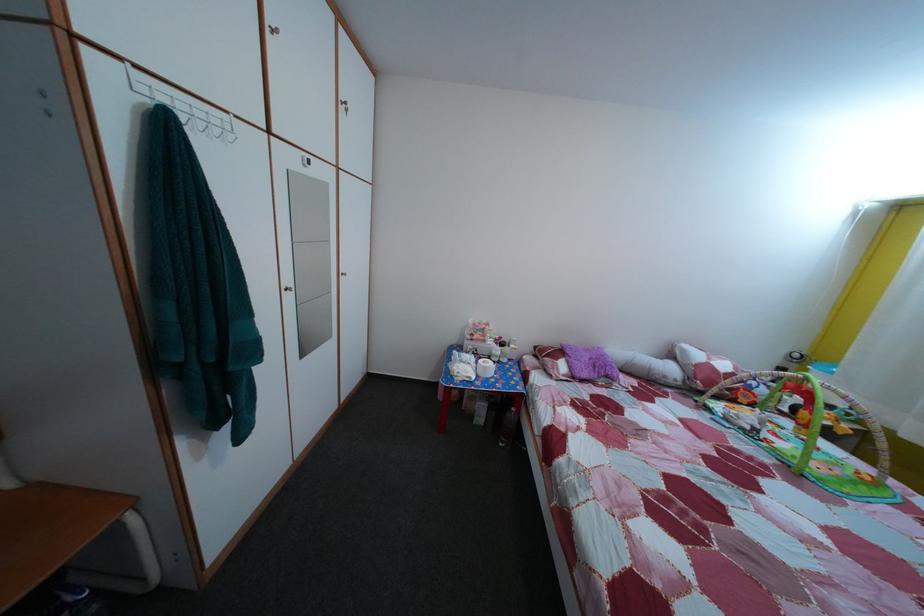
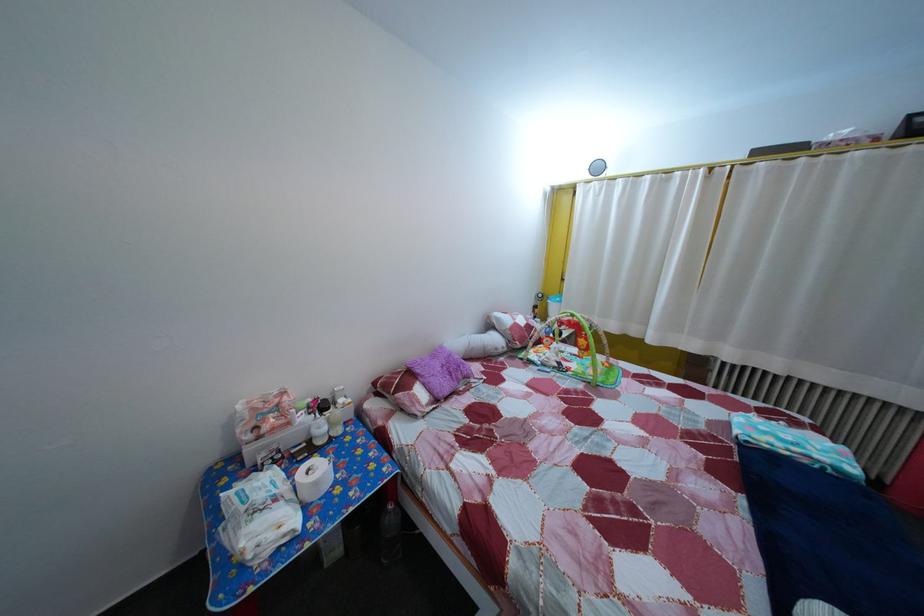
Find the pixel in the second image that matches pixel 757 435 in the first image.

(565, 371)